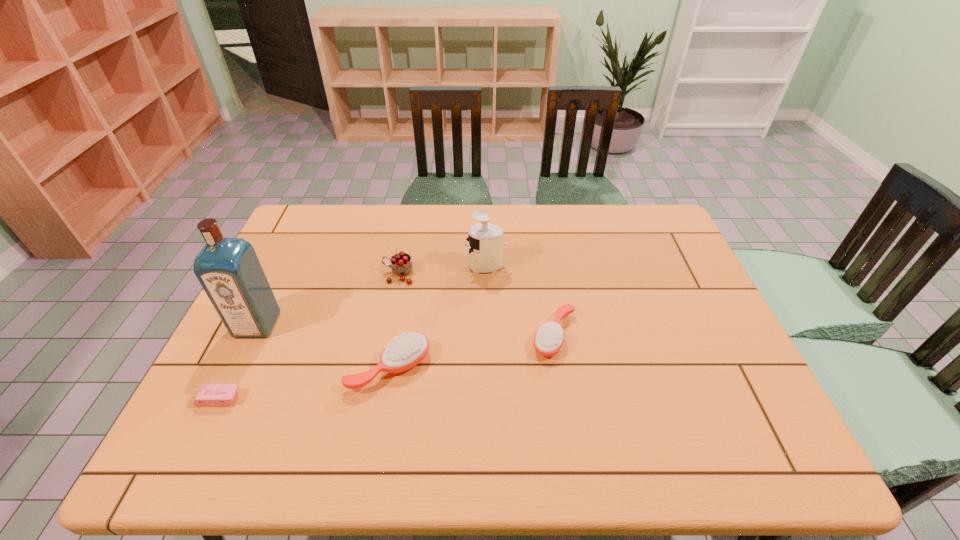
Find the location of a particular element. Image resolution: width=960 pixels, height=540 pixels. the taller hairbrush is located at coordinates (406, 351).

Locate an element on the screen. Image resolution: width=960 pixels, height=540 pixels. the left hairbrush is located at coordinates (406, 351).

Where is `the rightmost object`? This screenshot has height=540, width=960. the rightmost object is located at coordinates (548, 340).

Identify the location of the shorter hairbrush. (548, 340).

Locate an element on the screen. Image resolution: width=960 pixels, height=540 pixels. juicer is located at coordinates (485, 249).

Locate an element on the screen. This screenshot has height=540, width=960. the second tallest object is located at coordinates (485, 249).

Identify the location of the tallest object. The image size is (960, 540). (228, 269).

The width and height of the screenshot is (960, 540). Find the location of `the fourth shortest object`. the fourth shortest object is located at coordinates (401, 265).

At what (x,y) coordinates should I click in order to perform the action: click on the shortest object. Please return your answer as a coordinate pair (x, y). Looking at the image, I should click on (209, 395).

The height and width of the screenshot is (540, 960). I want to click on free space located on the right of the left hairbrush, so click(x=575, y=368).